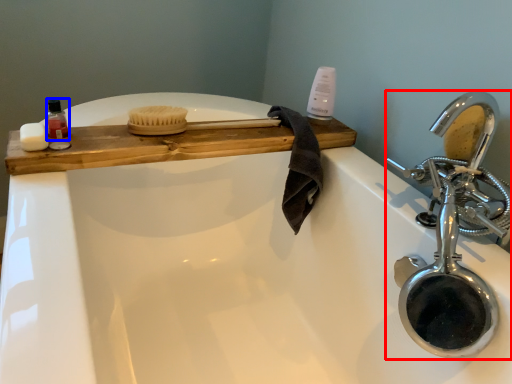
Question: Which object is further to the camera taking this photo, tap (highlighted by a red box) or mouthwash (highlighted by a blue box)?

Choices:
 (A) tap
 (B) mouthwash

Answer: (B)